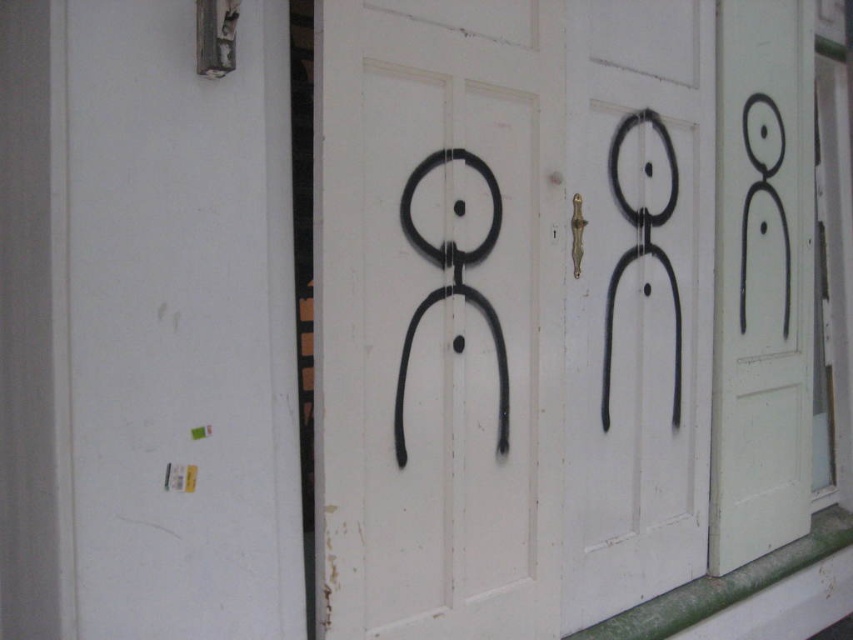
Who is taller, black matte figure at center or black matte door at right?

With more height is black matte door at right.

Between black matte figure at center and black matte door at right, which one is positioned lower?

black matte figure at center

Is point (572, 618) closer to viewer compared to point (756, 472)?

Yes, point (572, 618) is closer to viewer.

Image resolution: width=853 pixels, height=640 pixels. I want to click on black matte figure at center, so click(637, 301).

Does black matte door at center have a greater width compared to black matte figure at center?

Yes, black matte door at center is wider than black matte figure at center.

From the picture: Is black matte door at center below black matte figure at center?

Yes.

Where is `black matte door at center`? The height and width of the screenshot is (640, 853). black matte door at center is located at coordinates [x=509, y=310].

Where is `black matte door at center`? The height and width of the screenshot is (640, 853). black matte door at center is located at coordinates (509, 310).

Is point (538, 26) closer to camera compared to point (784, 493)?

That is True.

Can you confirm if black matte door at center is positioned to the left of black matte door at right?

Correct, you'll find black matte door at center to the left of black matte door at right.

What do you see at coordinates (509, 310) in the screenshot? I see `black matte door at center` at bounding box center [509, 310].

I want to click on black matte door at center, so click(x=509, y=310).